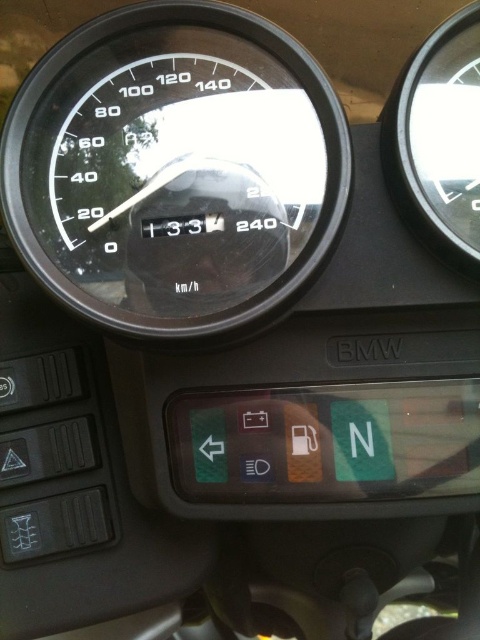
Question: Does black glass speedometer at center appear on the right side of transparent glass speedometer at upper right?

Choices:
 (A) no
 (B) yes

Answer: (A)

Question: Is black glass speedometer at center to the left of transparent glass speedometer at upper right from the viewer's perspective?

Choices:
 (A) no
 (B) yes

Answer: (B)

Question: Which point is closer to the camera?

Choices:
 (A) (271, 224)
 (B) (452, 29)

Answer: (B)

Question: Where is black glass speedometer at center located in relation to transparent glass speedometer at upper right in the image?

Choices:
 (A) above
 (B) below

Answer: (B)